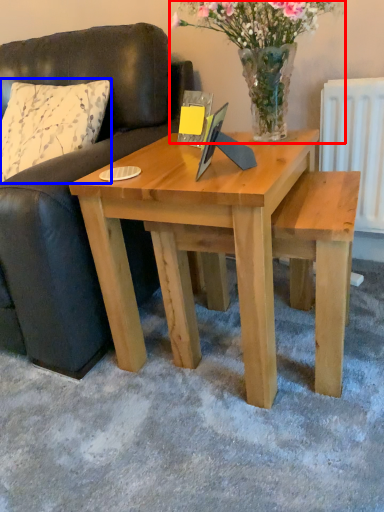
Question: Which object is further to the camera taking this photo, floral arrangement (highlighted by a red box) or pillow (highlighted by a blue box)?

Choices:
 (A) floral arrangement
 (B) pillow

Answer: (B)